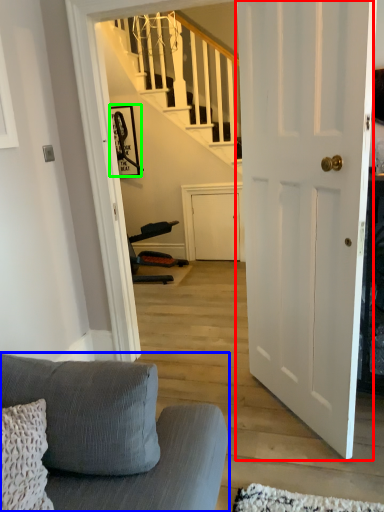
Question: Which object is the closest to the door (highlighted by a red box)? Choose among these: studio couch (highlighted by a blue box) or picture frame (highlighted by a green box).

Choices:
 (A) studio couch
 (B) picture frame

Answer: (A)